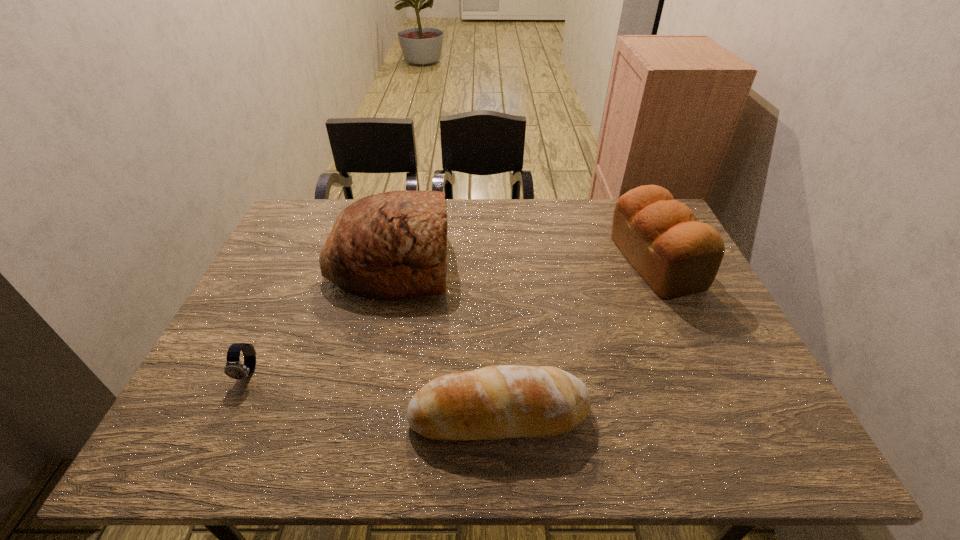
In order to click on vacant space in between the rightmost bread and the nearest bread in this screenshot , I will do `click(577, 338)`.

You are a GUI agent. You are given a task and a screenshot of the screen. Output one action in this format:
    pyautogui.click(x=<x>, y=<y>)
    Task: Click on the unoccupied position between the rightmost object and the watch
    The width and height of the screenshot is (960, 540).
    Given the screenshot: What is the action you would take?
    pyautogui.click(x=452, y=317)

Locate which object ranks second in proximity to the shortest bread. Please provide its 2D coordinates. Your answer should be formatted as a tuple, i.e. [(x, y)], where the tuple contains the x and y coordinates of a point satisfying the conditions above.

[(677, 256)]

The image size is (960, 540). What are the coordinates of `object that ranks as the closest to the shortest bread` in the screenshot? It's located at (393, 244).

Locate which bread is the closest to the third tallest object. Please provide its 2D coordinates. Your answer should be formatted as a tuple, i.e. [(x, y)], where the tuple contains the x and y coordinates of a point satisfying the conditions above.

[(393, 244)]

Locate an element on the screen. The height and width of the screenshot is (540, 960). bread identified as the second closest to the third tallest object is located at coordinates (677, 256).

This screenshot has height=540, width=960. I want to click on free space that satisfies the following two spatial constraints: 1. on the face of the second shortest object; 2. on the left side of the shortest object, so click(229, 414).